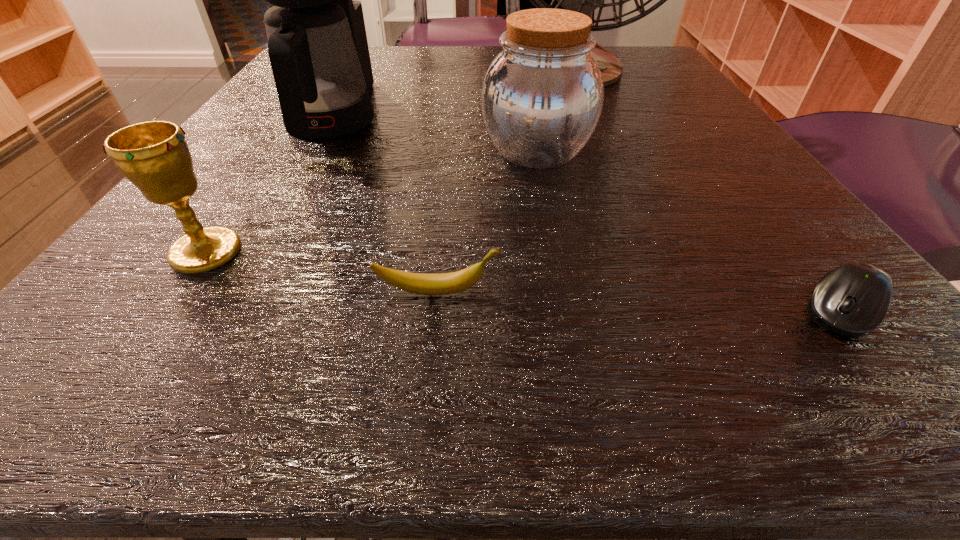
The width and height of the screenshot is (960, 540). I want to click on free space between the banana and the fifth shortest object, so click(385, 204).

You are a GUI agent. You are given a task and a screenshot of the screen. Output one action in this format:
    pyautogui.click(x=<x>, y=<y>)
    Task: Click on the unoccupied position between the coffee maker and the shortest object
    Image resolution: width=960 pixels, height=540 pixels.
    Given the screenshot: What is the action you would take?
    coord(587,212)

This screenshot has height=540, width=960. I want to click on free space between the tallest object and the second shortest object, so point(509,179).

This screenshot has width=960, height=540. I want to click on free spot between the mouse and the third nearest object, so click(523, 280).

This screenshot has height=540, width=960. What are the coordinates of `vacant space that's between the tallest object and the banana` in the screenshot? It's located at (509, 179).

In order to click on the fourth closest object to the shortest object in this screenshot , I will do `click(317, 44)`.

Locate an element on the screen. Image resolution: width=960 pixels, height=540 pixels. object identified as the second closest to the mouse is located at coordinates (445, 283).

Where is `free spot that satisfies the following two spatial constraints: 1. pour from the carafe of the coffee maker; 2. on the left side of the shortest object`? free spot that satisfies the following two spatial constraints: 1. pour from the carafe of the coffee maker; 2. on the left side of the shortest object is located at coordinates (227, 308).

Identify the location of free region that satisfies the following two spatial constraints: 1. pour from the carafe of the second tallest object; 2. on the left side of the third tallest object. (314, 152).